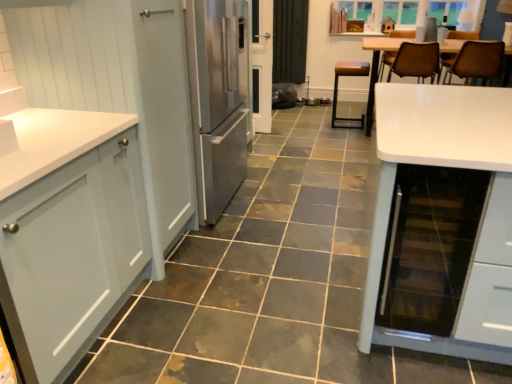
Question: Considering the positions of point (354, 127) and point (97, 198), is point (354, 127) closer or farther from the camera than point (97, 198)?

Choices:
 (A) closer
 (B) farther

Answer: (B)

Question: Do you think brown leather stool at center, which appears as the 1th chair when viewed from the left, is within matte gray cabinet at left, which ranks as the 2th cabinetry in back-to-front order, or outside of it?

Choices:
 (A) outside
 (B) inside

Answer: (A)

Question: Considering the real-world distances, which object is closest to the white glossy screen door at center?

Choices:
 (A) matte white cabinet at left, the second cabinetry when ordered from front to back
 (B) brown leather chair at upper right, placed as the third chair when sorted from left to right
 (C) black glass wine cooler at right
 (D) brown leather stool at center, acting as the third chair starting from the right
 (E) matte gray cabinet at left, which is the first cabinetry from front to back

Answer: (D)

Question: Which object is the farthest from the white glossy screen door at center?

Choices:
 (A) white glossy table at right
 (B) brown leather chair at upper right, positioned as the second chair in right-to-left order
 (C) matte white cabinet at left, the second cabinetry when ordered from front to back
 (D) brown leather chair at upper right, placed as the third chair when sorted from left to right
 (E) brown leather stool at center, acting as the third chair starting from the right

Answer: (A)